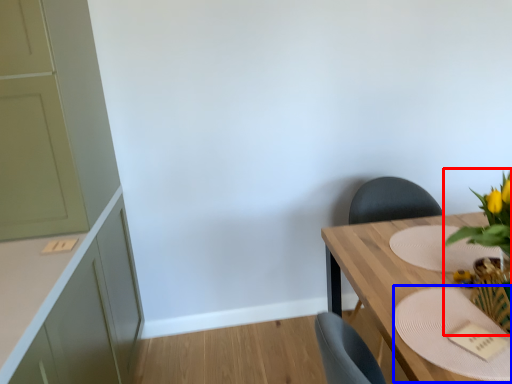
Question: Which point is closer to the camera, floral arrangement (highlighted by a red box) or plate (highlighted by a blue box)?

Choices:
 (A) floral arrangement
 (B) plate

Answer: (A)